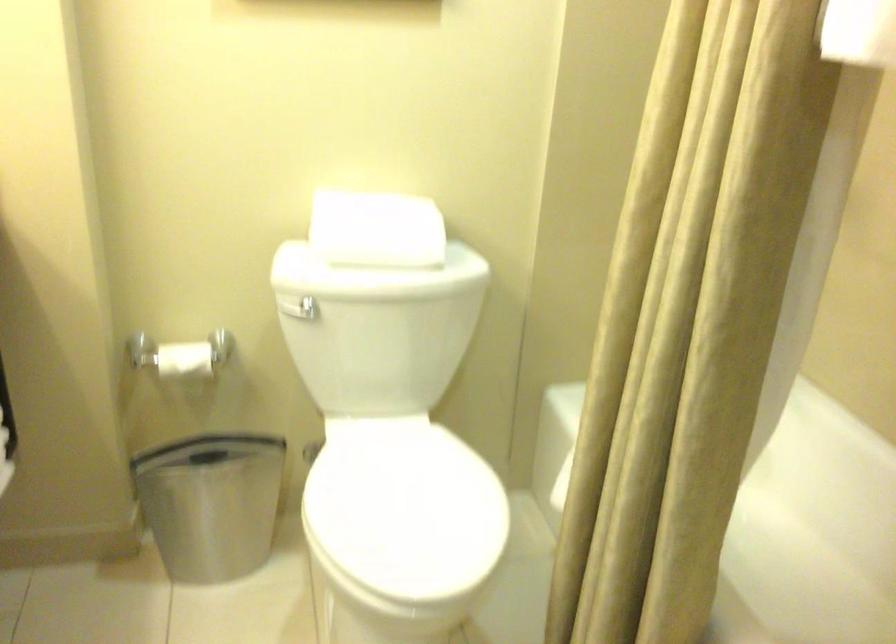
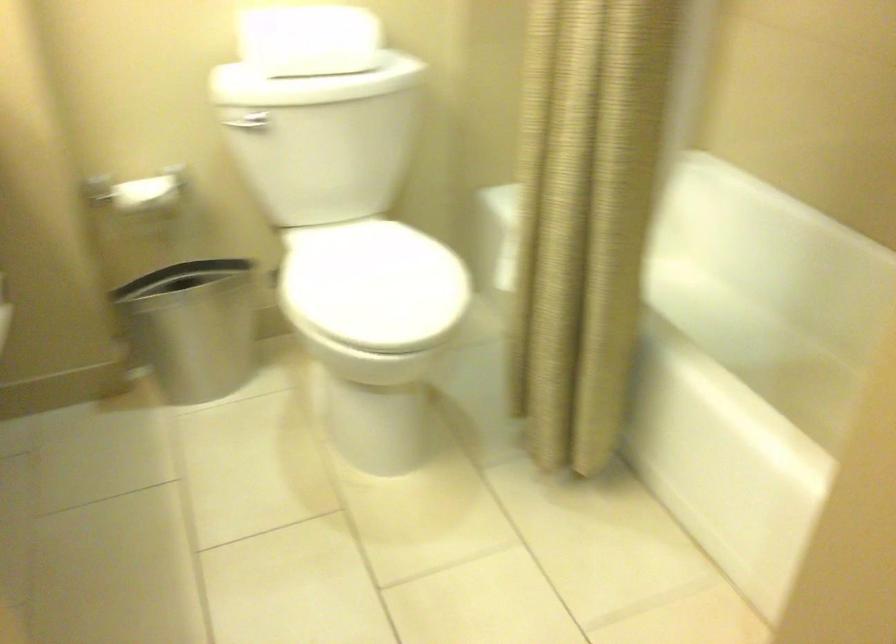
Locate, in the second image, the point that corresponds to the point at 300,307 in the first image.

(247, 122)